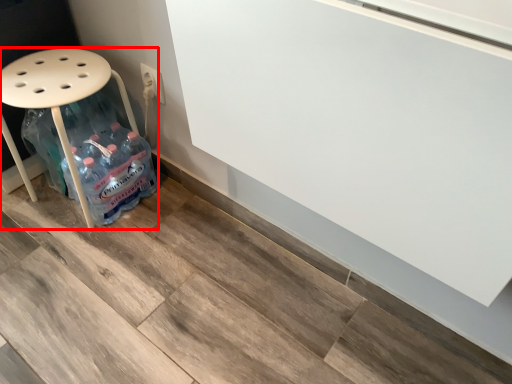
Question: From the image's perspective, what is the correct spatial positioning of furniture (annotated by the red box) in reference to electric outlet?

Choices:
 (A) above
 (B) below

Answer: (B)